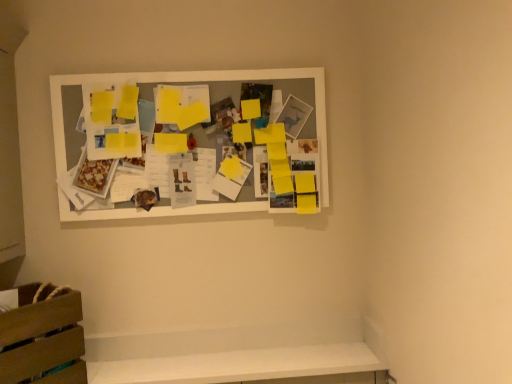
Question: Considering the relative sizes of white matte picture frame at upper center and wooden crate at lower left in the image provided, is white matte picture frame at upper center bigger than wooden crate at lower left?

Choices:
 (A) yes
 (B) no

Answer: (A)

Question: Does white matte picture frame at upper center have a lesser width compared to wooden crate at lower left?

Choices:
 (A) no
 (B) yes

Answer: (B)

Question: Can you confirm if white matte picture frame at upper center is shorter than wooden crate at lower left?

Choices:
 (A) yes
 (B) no

Answer: (B)

Question: From the image's perspective, is white matte picture frame at upper center located beneath wooden crate at lower left?

Choices:
 (A) yes
 (B) no

Answer: (B)

Question: Is wooden crate at lower left at the back of white matte picture frame at upper center?

Choices:
 (A) yes
 (B) no

Answer: (B)

Question: From the image's perspective, is white matte picture frame at upper center on top of wooden crate at lower left?

Choices:
 (A) no
 (B) yes

Answer: (B)

Question: Is wooden crate at lower left taller than white matte picture frame at upper center?

Choices:
 (A) yes
 (B) no

Answer: (B)

Question: Is the surface of wooden crate at lower left in direct contact with white matte picture frame at upper center?

Choices:
 (A) no
 (B) yes

Answer: (A)

Question: From a real-world perspective, is wooden crate at lower left physically above white matte picture frame at upper center?

Choices:
 (A) no
 (B) yes

Answer: (A)

Question: From the image's perspective, does wooden crate at lower left appear higher than white matte picture frame at upper center?

Choices:
 (A) yes
 (B) no

Answer: (B)

Question: Is wooden crate at lower left at the left side of white matte picture frame at upper center?

Choices:
 (A) no
 (B) yes

Answer: (B)

Question: Would you say wooden crate at lower left is outside white matte picture frame at upper center?

Choices:
 (A) no
 (B) yes

Answer: (B)

Question: From the image's perspective, is wooden crate at lower left above or below white matte picture frame at upper center?

Choices:
 (A) below
 (B) above

Answer: (A)